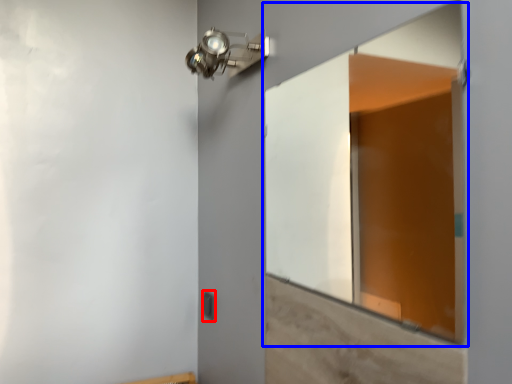
Question: Which of the following is the farthest to the observer, light switch (highlighted by a red box) or window (highlighted by a blue box)?

Choices:
 (A) light switch
 (B) window

Answer: (A)